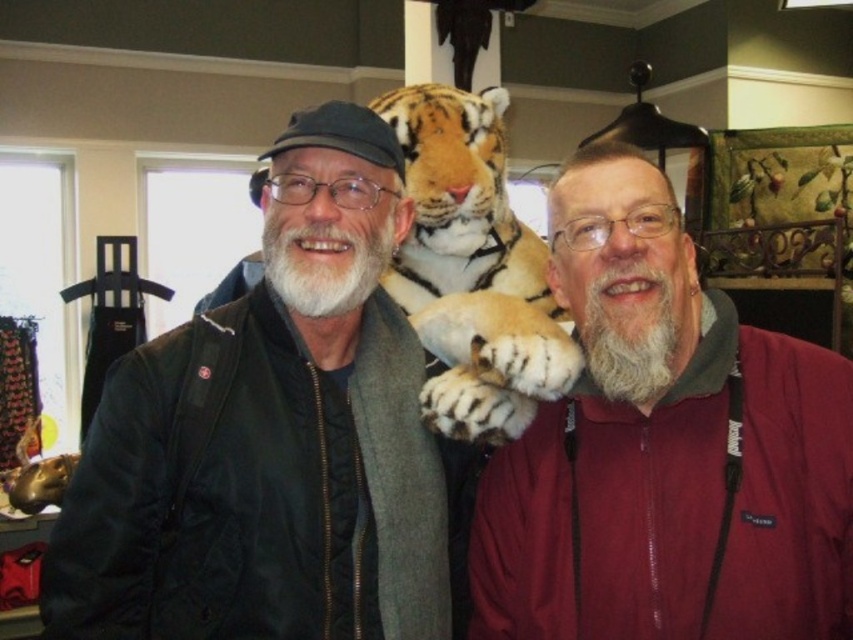
Does point (331, 304) come closer to viewer compared to point (476, 429)?

Yes.

Between point (225, 321) and point (450, 109), which one is positioned in front?

Point (225, 321) is in front.

Which is in front, point (329, 109) or point (524, 326)?

Point (329, 109)

The image size is (853, 640). What are the coordinates of `black matte jacket at left` in the screenshot? It's located at (271, 438).

Does maroon fleece jacket at center appear on the left side of orange fur tiger at center?

In fact, maroon fleece jacket at center is to the right of orange fur tiger at center.

Is point (808, 602) farther from viewer compared to point (463, 124)?

That is False.

Identify the location of maroon fleece jacket at center. The image size is (853, 640). (665, 449).

Which is more to the right, black matte jacket at left or maroon fleece jacket at center?

maroon fleece jacket at center

Is black matte jacket at left below maroon fleece jacket at center?

Actually, black matte jacket at left is above maroon fleece jacket at center.

Does point (259, 637) come in front of point (602, 449)?

Yes.

Where is `black matte jacket at left`? black matte jacket at left is located at coordinates (271, 438).